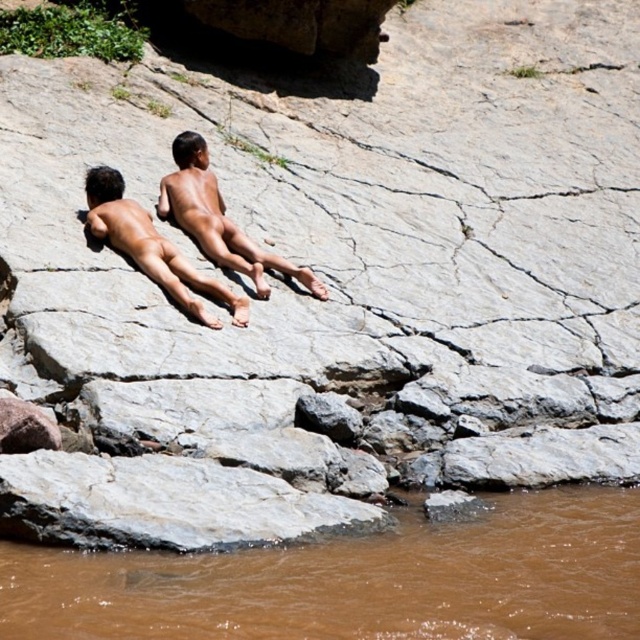
Between brown muddy water at lower left and matte skin man at center, which one appears on the right side from the viewer's perspective?

From the viewer's perspective, brown muddy water at lower left appears more on the right side.

Locate an element on the screen. The image size is (640, 640). brown muddy water at lower left is located at coordinates (356, 580).

You are a GUI agent. You are given a task and a screenshot of the screen. Output one action in this format:
    pyautogui.click(x=<x>, y=<y>)
    Task: Click on the brown muddy water at lower left
    
    Given the screenshot: What is the action you would take?
    pyautogui.click(x=356, y=580)

Where is `brown muddy water at lower left`? brown muddy water at lower left is located at coordinates [x=356, y=580].

How distant is brown muddy water at lower left from brown skin boy at center?

A distance of 21.69 feet exists between brown muddy water at lower left and brown skin boy at center.

Is brown muddy water at lower left in front of brown skin boy at center?

Yes, brown muddy water at lower left is in front of brown skin boy at center.

Between point (168, 618) and point (189, 301), which one is positioned in front?

Positioned in front is point (168, 618).

The image size is (640, 640). Find the location of `brown muddy water at lower left`. brown muddy water at lower left is located at coordinates (356, 580).

Does matte skin man at center appear under brown skin boy at center?

No.

In the scene shown: Can you confirm if matte skin man at center is shorter than brown skin boy at center?

No.

Which is in front, point (189, 157) or point (204, 323)?

Point (204, 323) is in front.

At what (x,y) coordinates should I click in order to perform the action: click on matte skin man at center. Please return your answer as a coordinate pair (x, y). Looking at the image, I should click on (218, 218).